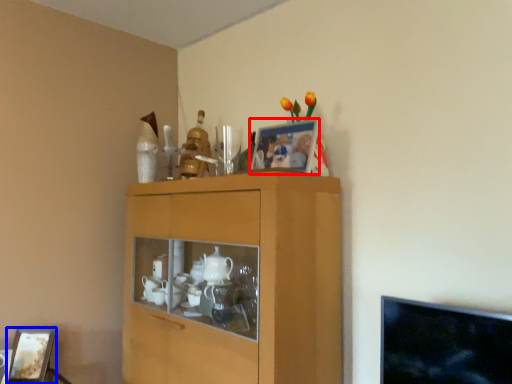
Question: Which object is further to the camera taking this photo, picture frame (highlighted by a red box) or picture frame (highlighted by a blue box)?

Choices:
 (A) picture frame
 (B) picture frame

Answer: (B)